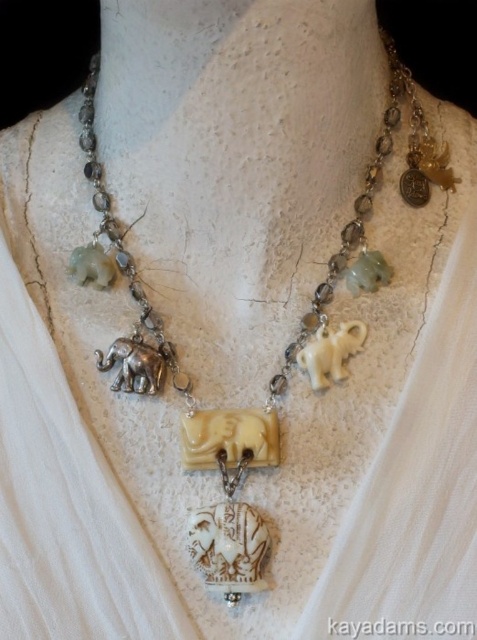
Does white ivory elephant at center appear over silver metallic elephant at center?

Yes.

Consider the image. Who is higher up, white ivory elephant at center or silver metallic elephant at center?

Positioned higher is white ivory elephant at center.

Find the location of a particular element. The image size is (477, 640). white ivory elephant at center is located at coordinates (331, 353).